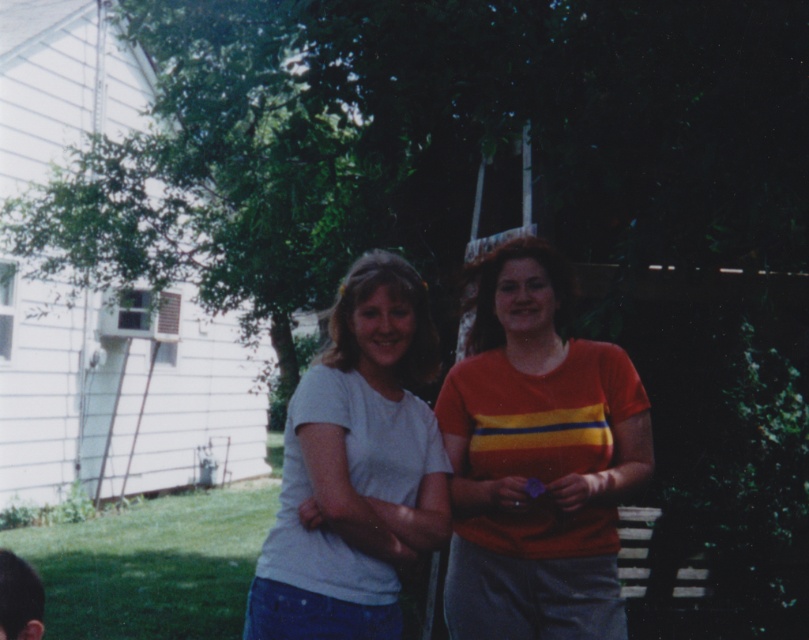
Question: Among these objects, which one is nearest to the camera?

Choices:
 (A) dark brown hair at lower left
 (B) white matte t-shirt at center

Answer: (A)

Question: Can you confirm if white matte t-shirt at center is positioned to the right of dark brown hair at lower left?

Choices:
 (A) no
 (B) yes

Answer: (B)

Question: Can you confirm if white matte t-shirt at center is positioned above dark brown hair at lower left?

Choices:
 (A) no
 (B) yes

Answer: (B)

Question: Which point is farther from the camera taking this photo?

Choices:
 (A) (15, 560)
 (B) (615, 566)

Answer: (B)

Question: Where is orange striped shirt at right located in relation to dark brown hair at lower left in the image?

Choices:
 (A) below
 (B) above

Answer: (B)

Question: Which point is farther from the camera taking this photo?

Choices:
 (A) click(x=20, y=630)
 (B) click(x=549, y=317)
 (C) click(x=397, y=419)

Answer: (B)